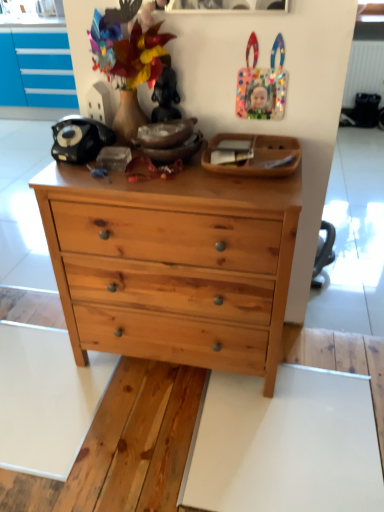
Question: Is wooden tray at upper center inside the boundaries of natural wood chest of drawers at center, or outside?

Choices:
 (A) outside
 (B) inside

Answer: (A)

Question: Is wooden tray at upper center in front of or behind natural wood chest of drawers at center in the image?

Choices:
 (A) behind
 (B) front

Answer: (A)

Question: Does point click(x=231, y=166) appear closer or farther from the camera than point click(x=195, y=287)?

Choices:
 (A) farther
 (B) closer

Answer: (B)

Question: Is natural wood chest of drawers at center to the left or to the right of wooden tray at upper center in the image?

Choices:
 (A) right
 (B) left

Answer: (B)

Question: From the image's perspective, is natural wood chest of drawers at center located above or below wooden tray at upper center?

Choices:
 (A) above
 (B) below

Answer: (B)

Question: Is point (256, 374) positioned closer to the camera than point (271, 145)?

Choices:
 (A) closer
 (B) farther

Answer: (B)

Question: Considering the positions of natural wood chest of drawers at center and wooden tray at upper center in the image, is natural wood chest of drawers at center wider or thinner than wooden tray at upper center?

Choices:
 (A) thin
 (B) wide

Answer: (B)